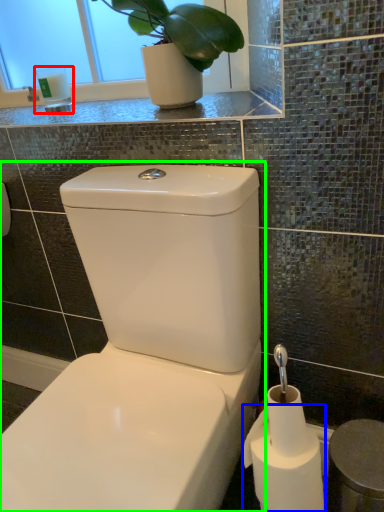
Question: Considering the real-world distances, which object is farthest from toiletry (highlighted by a red box)? toilet paper (highlighted by a blue box) or toilet (highlighted by a green box)?

Choices:
 (A) toilet paper
 (B) toilet

Answer: (A)